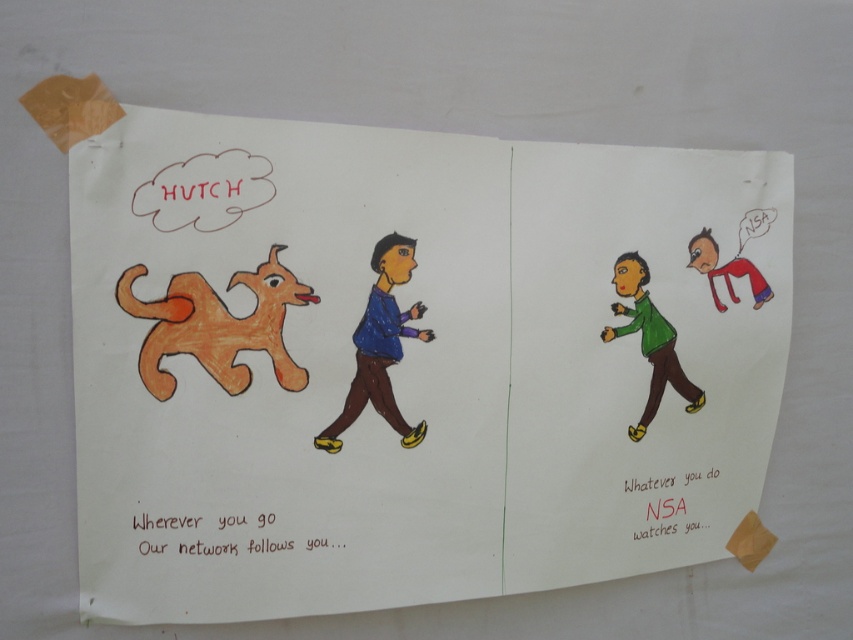
Question: Can you confirm if orange paper dog at left is bigger than matte blue shirt at center?

Choices:
 (A) no
 (B) yes

Answer: (B)

Question: Is matte blue shirt at center thinner than green matte shirt at center?

Choices:
 (A) no
 (B) yes

Answer: (B)

Question: Based on their relative distances, which object is farther from the orange paper dog at left?

Choices:
 (A) matte blue shirt at center
 (B) green matte shirt at center

Answer: (B)

Question: Which object is closer to the camera taking this photo?

Choices:
 (A) matte blue shirt at center
 (B) orange paper dog at left

Answer: (B)

Question: Does matte blue shirt at center have a lesser width compared to green matte shirt at center?

Choices:
 (A) yes
 (B) no

Answer: (A)

Question: Which point is farther to the camera?

Choices:
 (A) green matte shirt at center
 (B) matte blue shirt at center
 (C) orange paper dog at left

Answer: (A)